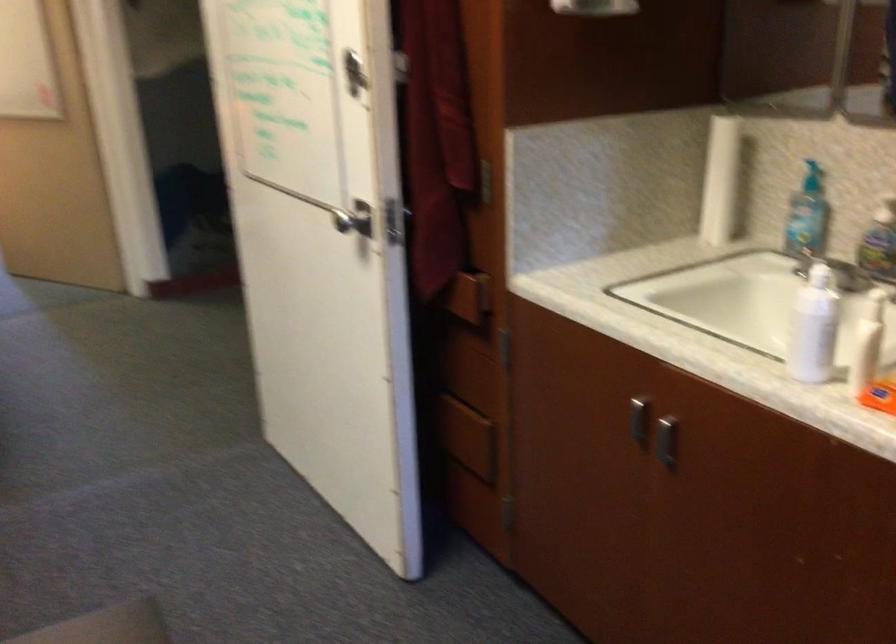
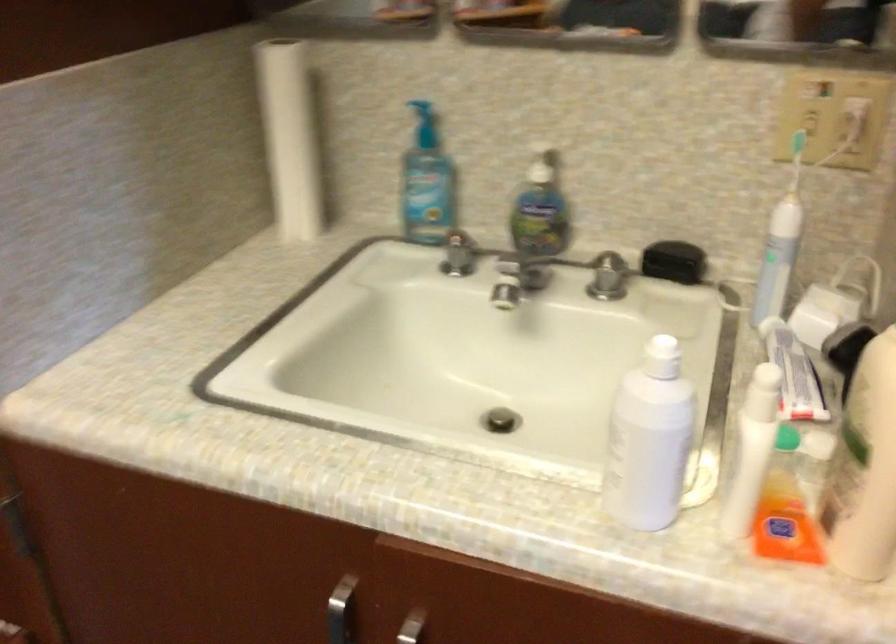
Where in the second image is the point corresponding to [710,173] from the first image?

(289, 138)